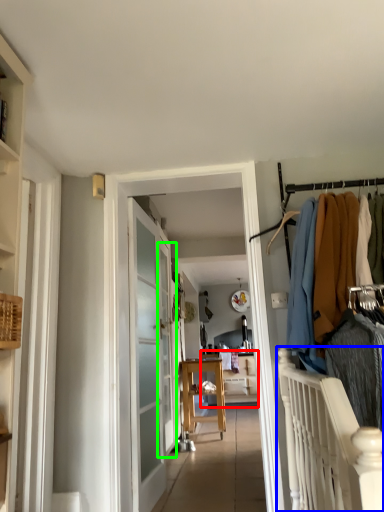
Question: Estimate the real-world distances between objects in this image. Which object is closer to furniture (highlighted by a red box), balustrade (highlighted by a blue box) or screen door (highlighted by a green box)?

Choices:
 (A) balustrade
 (B) screen door

Answer: (B)